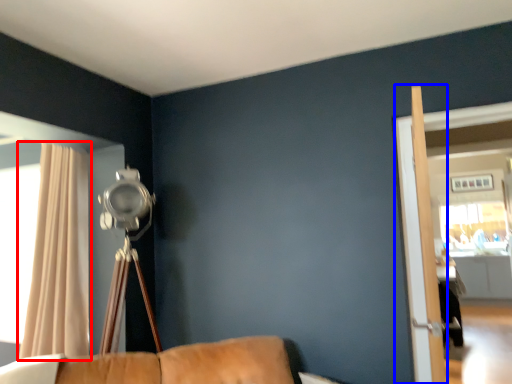
Question: Which of the following is the farthest to the observer, curtain (highlighted by a red box) or screen door (highlighted by a blue box)?

Choices:
 (A) curtain
 (B) screen door

Answer: (A)